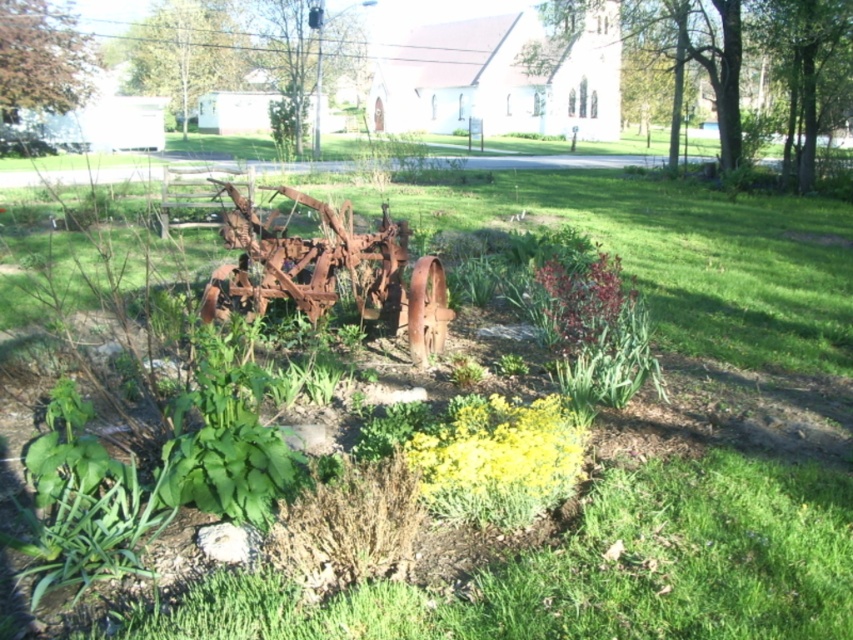
You are standing at the point with coordinates point (640, 316) and want to walk to the point with coordinates point (260, 221). Will you be moving forward or backward relative to your current position?

Since point (260, 221) is behind point (640, 316), moving to it would mean you are moving backward relative to your current position at point (640, 316).

You are a gardener standing in the garden and want to water both the yellow matte flower at center and the shiny red leaves at center. Which one should you water first if you want to start with the one closer to you?

You should water the yellow matte flower at center first because it is closer to you than the shiny red leaves at center.